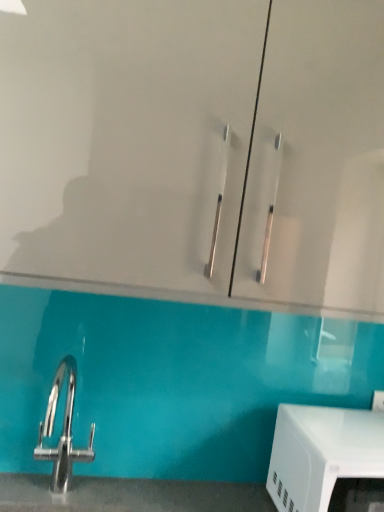
Find the location of `empty space that is ontop of white glossy microwave at lower right (from a real-world perspective)`. empty space that is ontop of white glossy microwave at lower right (from a real-world perspective) is located at coordinates (345, 423).